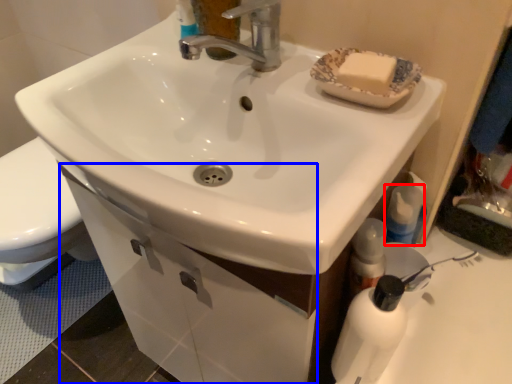
Question: Among these objects, which one is farthest to the camera, mouthwash (highlighted by a red box) or drawer (highlighted by a blue box)?

Choices:
 (A) mouthwash
 (B) drawer

Answer: (B)